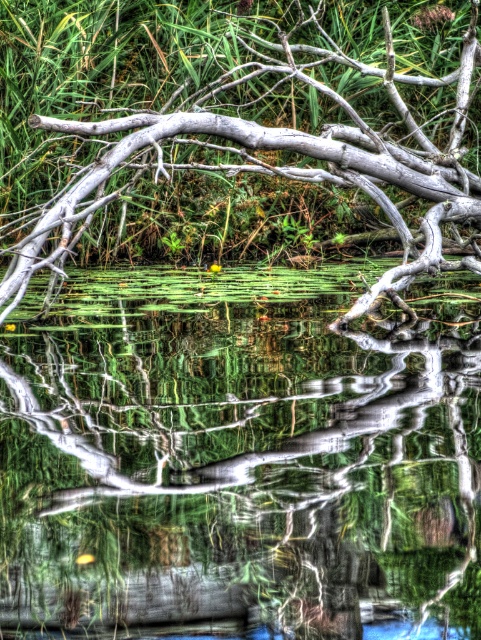
Between transparent water at center and gray wood tree branch at upper center, which one has less height?

With less height is gray wood tree branch at upper center.

From the picture: Is transparent water at center closer to the viewer compared to gray wood tree branch at upper center?

Yes, transparent water at center is in front of gray wood tree branch at upper center.

The height and width of the screenshot is (640, 481). What do you see at coordinates (240, 458) in the screenshot?
I see `transparent water at center` at bounding box center [240, 458].

Locate an element on the screen. This screenshot has height=640, width=481. transparent water at center is located at coordinates (240, 458).